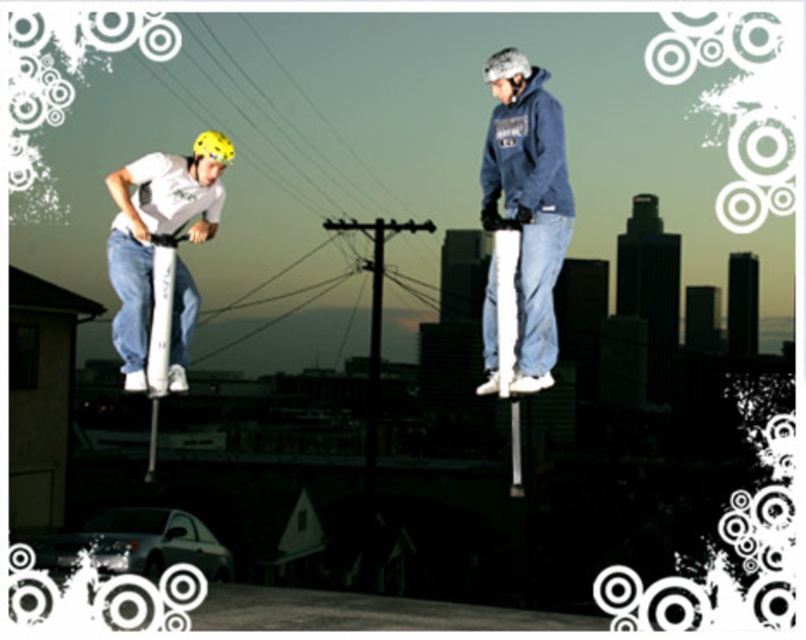
I want to click on white matte pogo stick at left, so click(156, 230).

Is white matte pogo stick at left thinner than silver metallic helmet at upper right?

Incorrect, white matte pogo stick at left's width is not less than silver metallic helmet at upper right's.

The height and width of the screenshot is (640, 806). What do you see at coordinates (156, 230) in the screenshot?
I see `white matte pogo stick at left` at bounding box center [156, 230].

At what (x,y) coordinates should I click in order to perform the action: click on white matte pogo stick at left. Please return your answer as a coordinate pair (x, y). Looking at the image, I should click on (156, 230).

Consider the image. How much distance is there between denim jeans at center and yellow matte helmet at left?

denim jeans at center and yellow matte helmet at left are 67.58 feet apart from each other.

Does point (561, 186) lie behind point (219, 134)?

No.

Describe the element at coordinates (528, 202) in the screenshot. I see `denim jeans at center` at that location.

Where is `denim jeans at center`? This screenshot has width=806, height=640. denim jeans at center is located at coordinates (528, 202).

Between silver metallic helmet at upper right and yellow matte helmet at left, which one appears on the right side from the viewer's perspective?

silver metallic helmet at upper right is more to the right.

Is point (513, 51) closer to viewer compared to point (196, 176)?

That is True.

Between point (484, 68) and point (200, 177), which one is positioned behind?

Point (200, 177)

Identify the location of silver metallic helmet at upper right. [x=505, y=74].